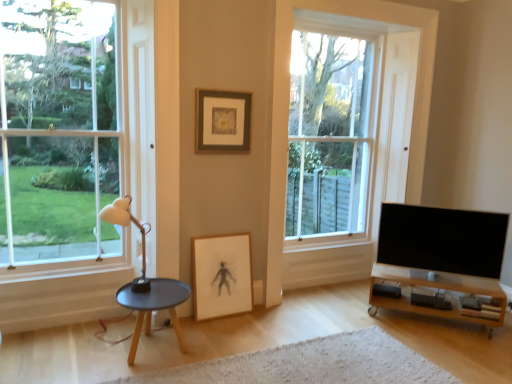
Question: Can you confirm if clear glass window at center, which is the 2th window from left to right, is thinner than white textured rug at lower center?

Choices:
 (A) yes
 (B) no

Answer: (A)

Question: Can white textured rug at lower center be found inside clear glass window at center, the first window when ordered from right to left?

Choices:
 (A) yes
 (B) no

Answer: (B)

Question: Can you see clear glass window at center, which is the 2th window from left to right, touching white textured rug at lower center?

Choices:
 (A) yes
 (B) no

Answer: (B)

Question: From a real-world perspective, is clear glass window at center, which is the 2th window from left to right, located higher than white textured rug at lower center?

Choices:
 (A) no
 (B) yes

Answer: (B)

Question: Does clear glass window at center, the first window when ordered from right to left, lie behind white textured rug at lower center?

Choices:
 (A) yes
 (B) no

Answer: (A)

Question: Is white textured rug at lower center to the left or to the right of matte black table at lower left in the image?

Choices:
 (A) left
 (B) right

Answer: (B)

Question: From the image's perspective, relative to matte black table at lower left, is white textured rug at lower center above or below?

Choices:
 (A) above
 (B) below

Answer: (B)

Question: From a real-world perspective, relative to matte black table at lower left, is white textured rug at lower center vertically above or below?

Choices:
 (A) above
 (B) below

Answer: (B)

Question: From their relative heights in the image, would you say white textured rug at lower center is taller or shorter than matte black table at lower left?

Choices:
 (A) short
 (B) tall

Answer: (A)

Question: Is clear glass window at center, which is the 2th window from left to right, inside the boundaries of wooden tv stand at lower right, or outside?

Choices:
 (A) outside
 (B) inside

Answer: (A)

Question: From a real-world perspective, relative to wooden tv stand at lower right, is clear glass window at center, which is the 2th window from left to right, vertically above or below?

Choices:
 (A) below
 (B) above

Answer: (B)

Question: Looking at the image, does clear glass window at center, which is the 2th window from left to right, seem bigger or smaller compared to wooden tv stand at lower right?

Choices:
 (A) big
 (B) small

Answer: (A)

Question: Considering their positions, is clear glass window at center, which is the 2th window from left to right, located in front of or behind wooden tv stand at lower right?

Choices:
 (A) behind
 (B) front

Answer: (A)

Question: Considering the positions of point (480, 221) and point (419, 276), is point (480, 221) closer or farther from the camera than point (419, 276)?

Choices:
 (A) closer
 (B) farther

Answer: (A)

Question: Considering the positions of black glossy tv at lower right and wooden tv stand at lower right in the image, is black glossy tv at lower right taller or shorter than wooden tv stand at lower right?

Choices:
 (A) short
 (B) tall

Answer: (B)